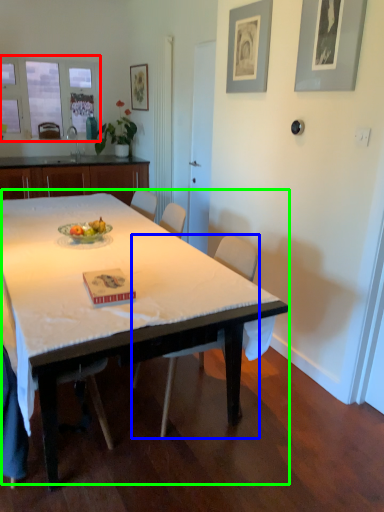
Question: Considering the real-world distances, which object is closest to window screen (highlighted by a red box)? chair (highlighted by a blue box) or table (highlighted by a green box).

Choices:
 (A) chair
 (B) table

Answer: (B)